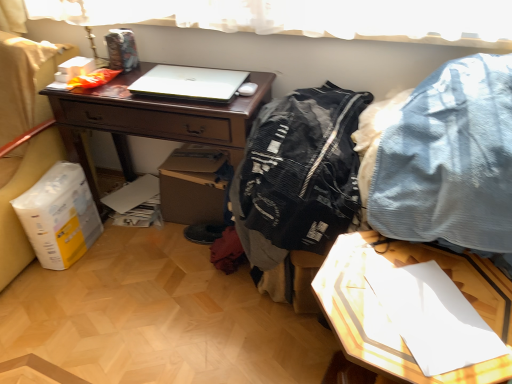
Where is `free location in front of matte brown desk at center`? Image resolution: width=512 pixels, height=384 pixels. free location in front of matte brown desk at center is located at coordinates (152, 307).